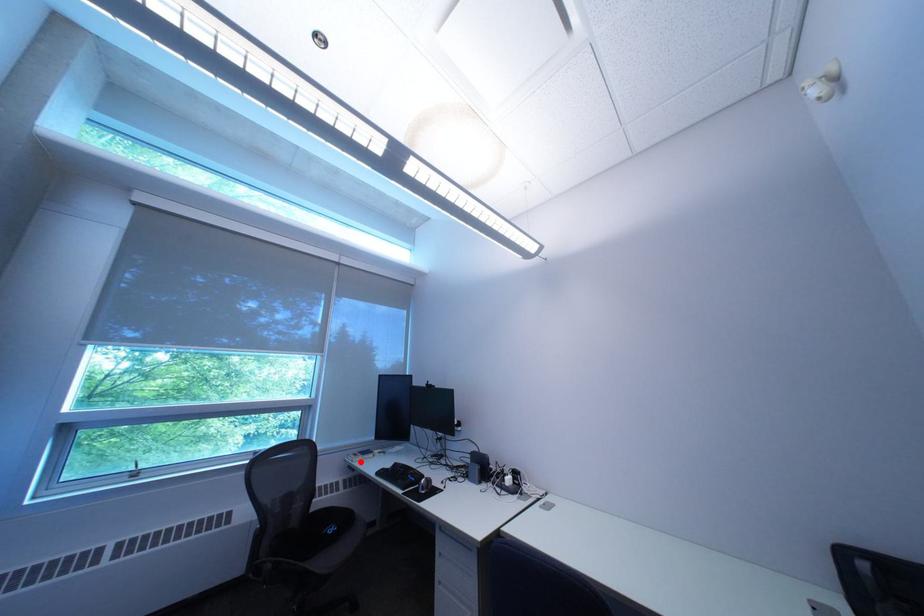
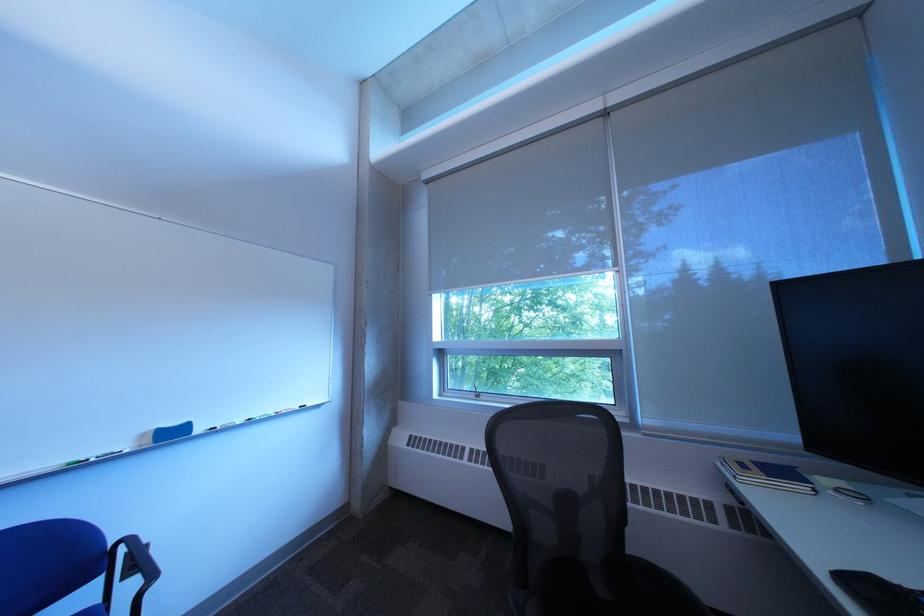
Question: I am providing you with two images of the same scene from different viewpoints. In image1, a red point is highlighted. Considering the same 3D point in image2, which of the following is correct?

Choices:
 (A) It is closer
 (B) It is farther

Answer: (A)